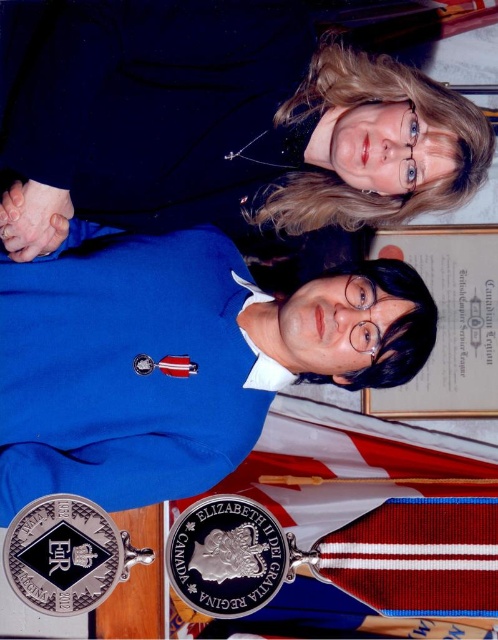
This screenshot has width=498, height=640. Describe the element at coordinates (342, 531) in the screenshot. I see `red-white-striped flag at center` at that location.

Based on the photo, is red-white-striped flag at center above black enamel badge at lower left?

Yes, red-white-striped flag at center is above black enamel badge at lower left.

Describe the element at coordinates (342, 531) in the screenshot. The image size is (498, 640). I see `red-white-striped flag at center` at that location.

At what (x,y) coordinates should I click in order to perform the action: click on red-white-striped flag at center. Please return your answer as a coordinate pair (x, y). Looking at the image, I should click on (342, 531).

Can you confirm if red-white-striped flag at center is shorter than red fabric flag at center?

Incorrect, red-white-striped flag at center's height does not fall short of red fabric flag at center's.

Identify the location of red-white-striped flag at center. pos(342,531).

Which is in front, point (474, 552) or point (480, 572)?

Point (480, 572) is more forward.

The height and width of the screenshot is (640, 498). Identify the location of red-white-striped flag at center. (342, 531).

Between point (304, 163) and point (420, 449), which one is positioned in front?

Point (420, 449)

Who is more distant from viewer, (68, 150) or (294, 438)?

Point (68, 150)

Does point (130, 12) come closer to viewer compared to point (491, 604)?

No, (130, 12) is behind (491, 604).

At what (x,y) coordinates should I click in order to perform the action: click on matte black jacket at upper center. Please return your answer as a coordinate pair (x, y). The image size is (498, 640). Looking at the image, I should click on (227, 124).